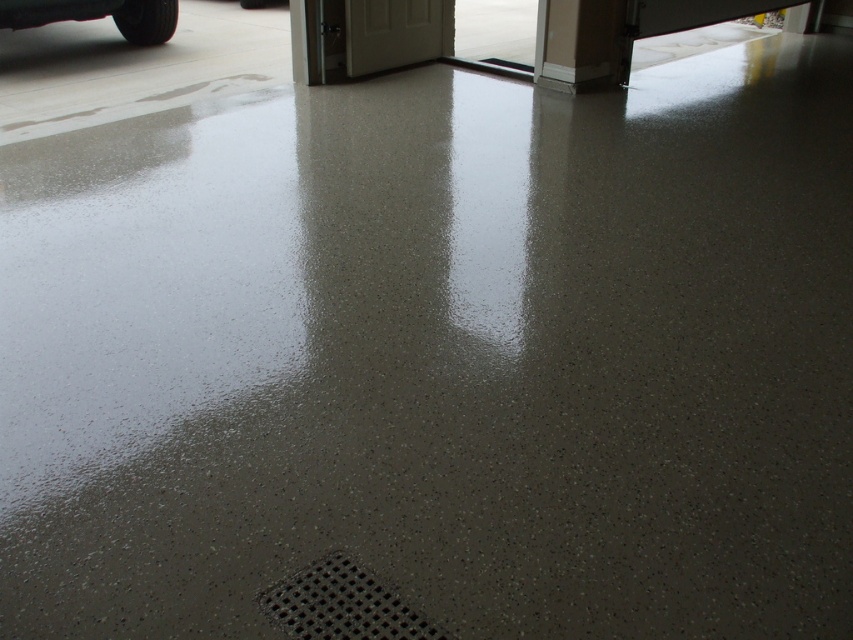
Who is higher up, black textured drain at lower center or shiny black car at upper left?

Positioned higher is shiny black car at upper left.

Is point (305, 636) positioned after point (71, 19)?

No, (305, 636) is closer to viewer.

Where is `black textured drain at lower center`? This screenshot has width=853, height=640. black textured drain at lower center is located at coordinates (341, 604).